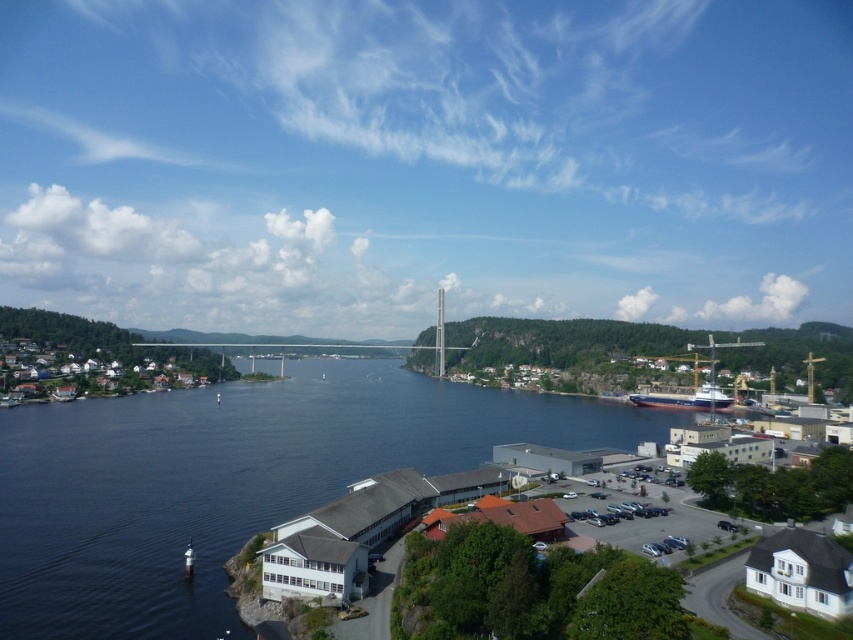
Question: Is blue water at center wider than blue metallic ship at lower right?

Choices:
 (A) no
 (B) yes

Answer: (B)

Question: Among these objects, which one is farthest from the camera?

Choices:
 (A) blue metallic ship at lower right
 (B) white wooden houses at left
 (C) blue water at center

Answer: (A)

Question: Is white wooden houses at left positioned behind blue metallic ship at lower right?

Choices:
 (A) no
 (B) yes

Answer: (A)

Question: Among these points, which one is nearest to the camera?

Choices:
 (A) (727, 397)
 (B) (144, 518)

Answer: (B)

Question: In this image, where is white wooden houses at left located relative to blue metallic ship at lower right?

Choices:
 (A) right
 (B) left

Answer: (B)

Question: Estimate the real-world distances between objects in this image. Which object is closer to the blue water at center?

Choices:
 (A) white wooden houses at left
 (B) blue metallic ship at lower right

Answer: (A)